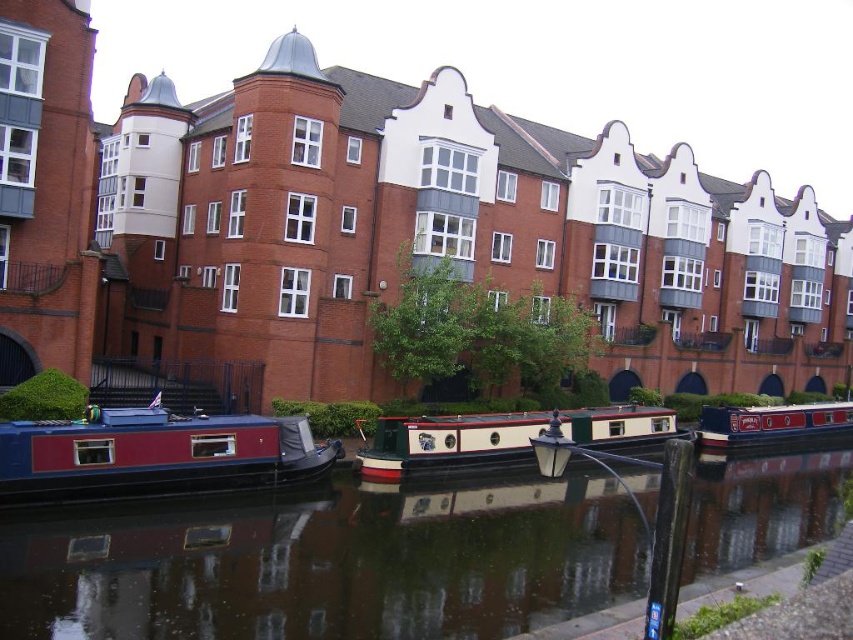
You are a tour guide leading a group along the canal. You want to inform your group about the distance between the white glossy barge at center and the blue polished wood boat at center. What do you tell them?

The distance between the white glossy barge at center and the blue polished wood boat at center is 19.69 meters.

You are standing at the edge of the canal looking at the three docked narrowboats. You notice two points marked on the boats. Which of the two points, point 1 at coordinates point (524, 579) or point 2 at coordinates point (624, 417), is closer to you?

Point 1 at coordinates point (524, 579) is closer to the viewer than point 2 at coordinates point (624, 417).

You are a delivery drone that needs to land on the white glossy barge at center. The landing pad is on the smooth dark water at center. Can you safely land there?

The smooth dark water at center is bigger than the white glossy barge at center, so yes, the drone can safely land on the smooth dark water at center as it has enough space.